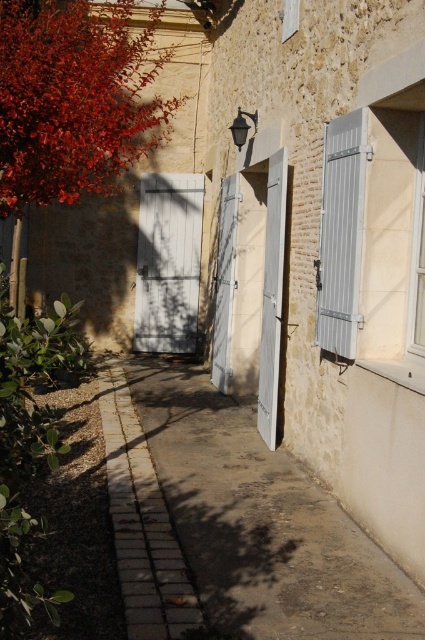
Can you confirm if paved concrete sidewalk at center is positioned to the right of paved stone path at center?

Yes, paved concrete sidewalk at center is to the right of paved stone path at center.

This screenshot has width=425, height=640. What are the coordinates of `paved concrete sidewalk at center` in the screenshot? It's located at (258, 522).

Can you confirm if paved stone path at center is taller than white wood door at center?

In fact, paved stone path at center may be shorter than white wood door at center.

Can you confirm if paved stone path at center is wider than white wood door at center?

Yes, paved stone path at center is wider than white wood door at center.

The width and height of the screenshot is (425, 640). What do you see at coordinates (141, 522) in the screenshot?
I see `paved stone path at center` at bounding box center [141, 522].

At what (x,y) coordinates should I click in order to perform the action: click on paved stone path at center. Please return your answer as a coordinate pair (x, y). Looking at the image, I should click on (141, 522).

Does bright red leaves at left have a smaller size compared to white matte door at center?

Actually, bright red leaves at left might be larger than white matte door at center.

Does bright red leaves at left have a greater width compared to white matte door at center?

No.

Measure the distance between point (13, 129) and camera.

Point (13, 129) and camera are 5.11 meters apart from each other.

What are the coordinates of `bright red leaves at left` in the screenshot? It's located at (74, 99).